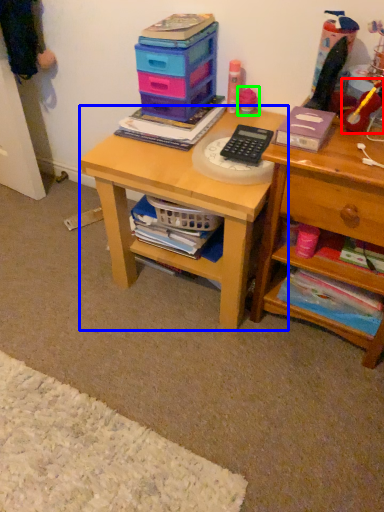
Question: Which object is the farthest from toy (highlighted by a red box)? Choose among these: desk (highlighted by a blue box) or toy (highlighted by a green box).

Choices:
 (A) desk
 (B) toy

Answer: (A)